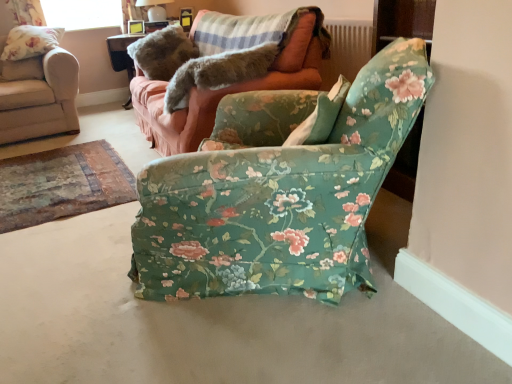
Locate an element on the screen. The image size is (512, 384). vacant space that is to the left of floral fabric chair at center, the 2th chair when ordered from left to right is located at coordinates pos(77,279).